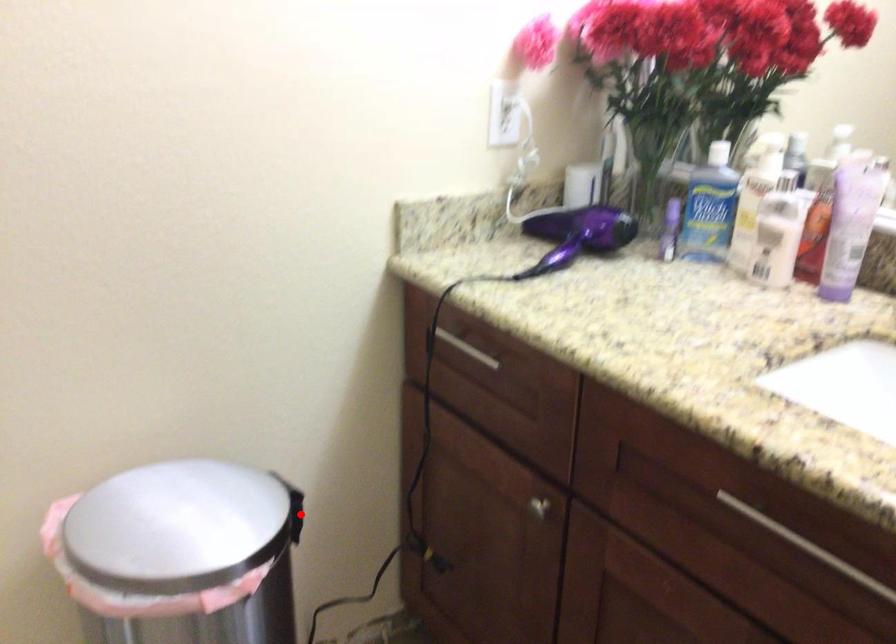
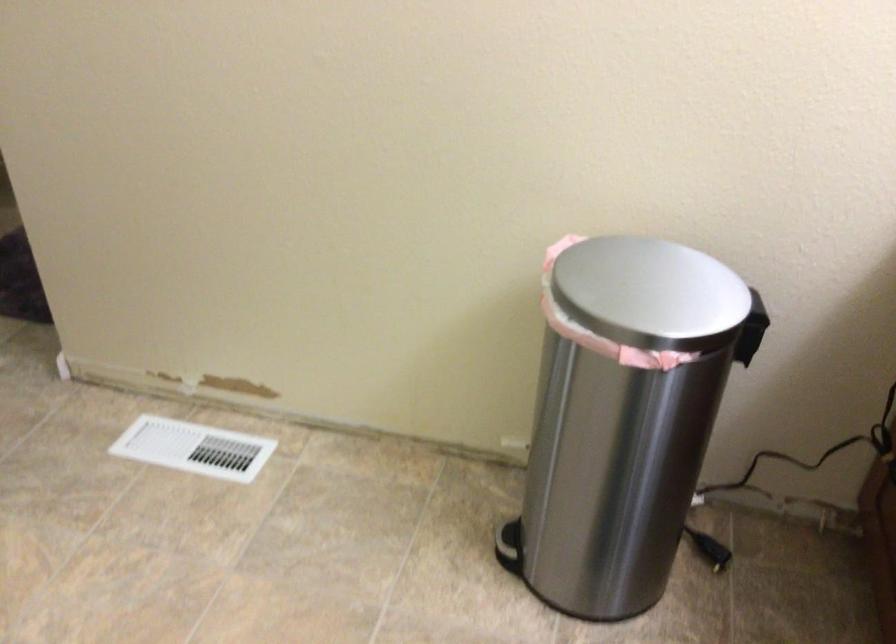
The point at the highlighted location is marked in the first image. Where is the corresponding point in the second image?

(750, 337)